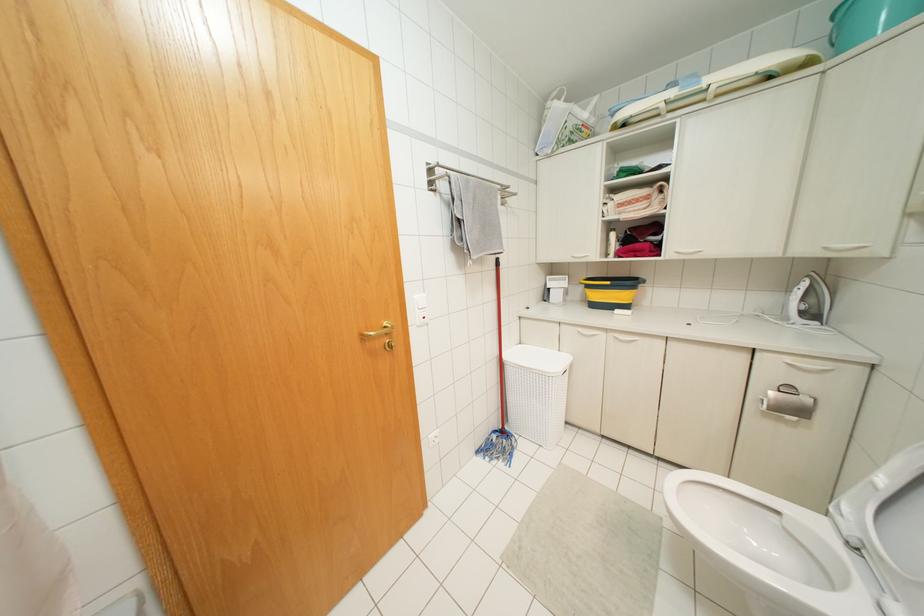
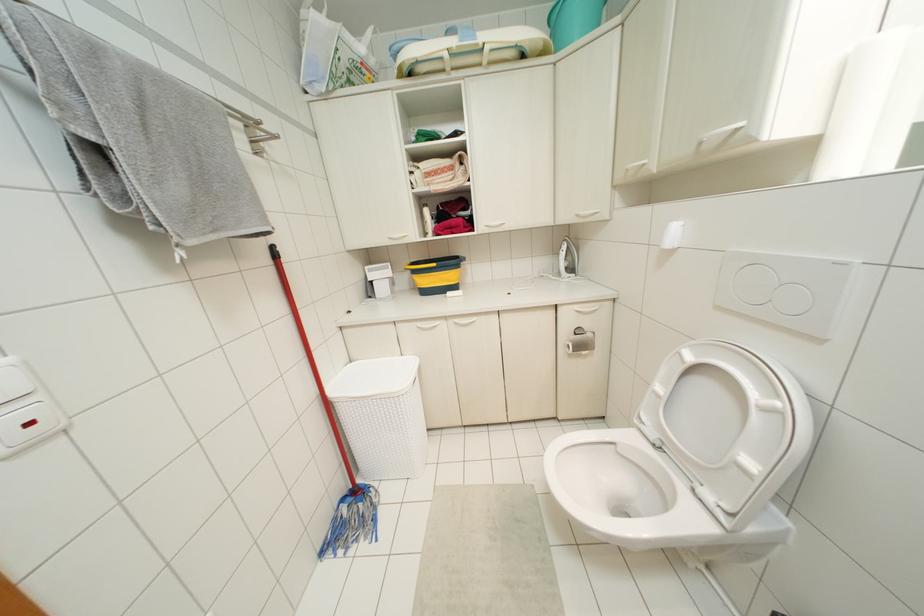
The point at (608,283) is marked in the first image. Where is the corresponding point in the second image?

(433, 264)